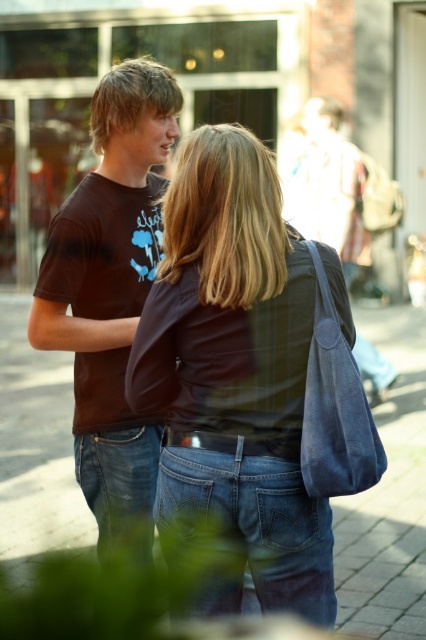
Question: Can you confirm if dark brown leather jacket at center is wider than blue denim jeans at lower center?

Choices:
 (A) yes
 (B) no

Answer: (B)

Question: Estimate the real-world distances between objects in this image. Which object is farther from the blue denim jeans at lower center?

Choices:
 (A) dark brown leather jacket at center
 (B) brown cotton t-shirt at left

Answer: (B)

Question: Is dark brown leather jacket at center smaller than blue denim jeans at lower center?

Choices:
 (A) no
 (B) yes

Answer: (B)

Question: Can you confirm if dark brown leather jacket at center is bigger than blue denim jeans at lower center?

Choices:
 (A) yes
 (B) no

Answer: (B)

Question: Which of the following is the farthest from the observer?

Choices:
 (A) dark brown leather jacket at center
 (B) brown cotton t-shirt at left
 (C) blue denim jeans at lower center

Answer: (C)

Question: Estimate the real-world distances between objects in this image. Which object is closer to the blue denim jeans at lower center?

Choices:
 (A) dark brown leather jacket at center
 (B) brown cotton t-shirt at left

Answer: (A)